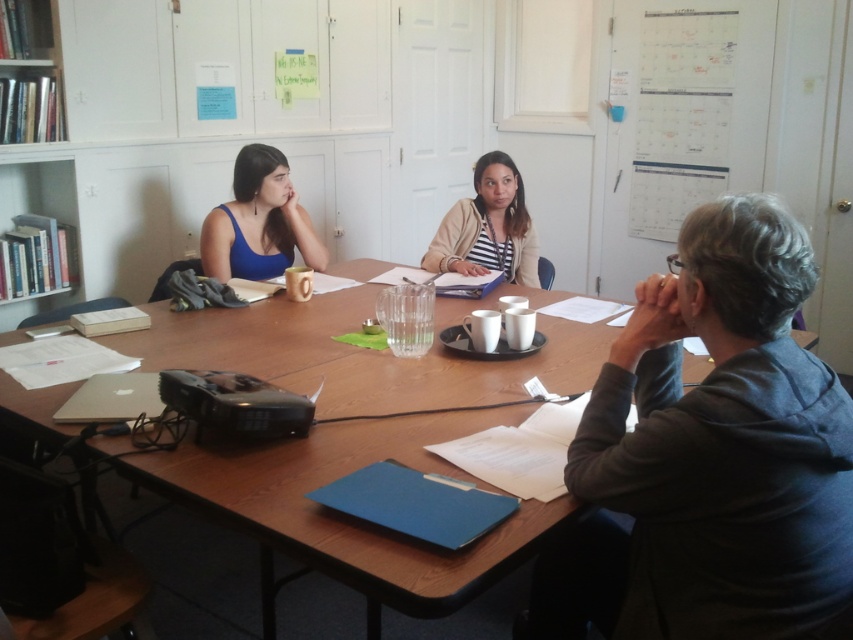
Is matte blue tank top at left closer to the viewer compared to striped jersey shirt at center?

That is False.

How distant is matte blue tank top at left from striped jersey shirt at center?

matte blue tank top at left and striped jersey shirt at center are 27.89 inches apart from each other.

Is point (215, 275) behind point (503, 259)?

No.

Where is `matte blue tank top at left`? This screenshot has height=640, width=853. matte blue tank top at left is located at coordinates (258, 221).

Is wooden table at center thinner than white paper calendar at upper right?

Incorrect, wooden table at center's width is not less than white paper calendar at upper right's.

Based on the photo, is wooden table at center further to camera compared to white paper calendar at upper right?

That is False.

Which is in front, point (351, 413) or point (718, 172)?

Point (351, 413) is more forward.

The width and height of the screenshot is (853, 640). I want to click on wooden table at center, so click(x=350, y=518).

This screenshot has width=853, height=640. What do you see at coordinates (724, 442) in the screenshot?
I see `gray cotton hoodie at lower right` at bounding box center [724, 442].

Is point (718, 621) positioned in front of point (225, 228)?

Yes, point (718, 621) is closer to viewer.

You are a GUI agent. You are given a task and a screenshot of the screen. Output one action in this format:
    pyautogui.click(x=<x>, y=<y>)
    Task: Click on the gray cotton hoodie at lower right
    
    Given the screenshot: What is the action you would take?
    pyautogui.click(x=724, y=442)